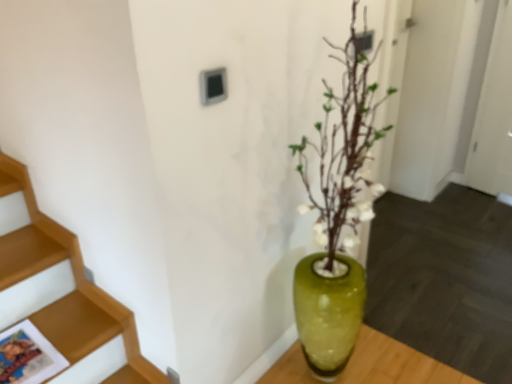
Question: Does green glass vase at center have a larger size compared to green glass vase at center?

Choices:
 (A) yes
 (B) no

Answer: (A)

Question: From a real-world perspective, is green glass vase at center located beneath green glass vase at center?

Choices:
 (A) no
 (B) yes

Answer: (A)

Question: Is green glass vase at center aimed at green glass vase at center?

Choices:
 (A) yes
 (B) no

Answer: (B)

Question: Is the surface of green glass vase at center in direct contact with green glass vase at center?

Choices:
 (A) no
 (B) yes

Answer: (A)

Question: Is green glass vase at center shorter than green glass vase at center?

Choices:
 (A) no
 (B) yes

Answer: (A)

Question: Is green glass vase at center further to camera compared to green glass vase at center?

Choices:
 (A) yes
 (B) no

Answer: (B)

Question: Considering the relative sizes of green glass vase at center and green glass vase at center in the image provided, is green glass vase at center shorter than green glass vase at center?

Choices:
 (A) yes
 (B) no

Answer: (A)

Question: From a real-world perspective, does green glass vase at center sit lower than green glass vase at center?

Choices:
 (A) yes
 (B) no

Answer: (A)

Question: Is green glass vase at center bigger than green glass vase at center?

Choices:
 (A) no
 (B) yes

Answer: (A)

Question: Does green glass vase at center have a greater width compared to green glass vase at center?

Choices:
 (A) yes
 (B) no

Answer: (B)

Question: Is green glass vase at center oriented towards green glass vase at center?

Choices:
 (A) yes
 (B) no

Answer: (A)

Question: Is green glass vase at center touching green glass vase at center?

Choices:
 (A) no
 (B) yes

Answer: (A)

Question: In terms of height, does green glass vase at center look taller or shorter compared to green glass vase at center?

Choices:
 (A) short
 (B) tall

Answer: (A)